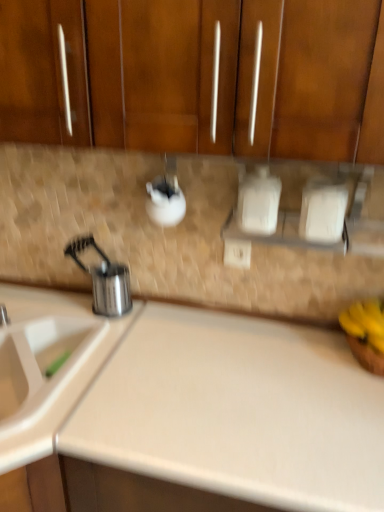
Question: In terms of size, does white plastic electric outlet at center appear bigger or smaller than stainless steel utensil holder at left?

Choices:
 (A) big
 (B) small

Answer: (B)

Question: Is white plastic electric outlet at center taller or shorter than stainless steel utensil holder at left?

Choices:
 (A) short
 (B) tall

Answer: (A)

Question: Which of these objects is positioned farthest from the white plastic electric outlet at center?

Choices:
 (A) beige laminate counter top at center
 (B) brushed metal tap at left
 (C) white plastic sink at lower left
 (D) stainless steel utensil holder at left
 (E) yellow matte bananas at right

Answer: (B)

Question: Which of these objects is positioned closest to the brushed metal tap at left?

Choices:
 (A) beige laminate counter top at center
 (B) white plastic electric outlet at center
 (C) white plastic sink at lower left
 (D) stainless steel utensil holder at left
 (E) yellow matte bananas at right

Answer: (C)